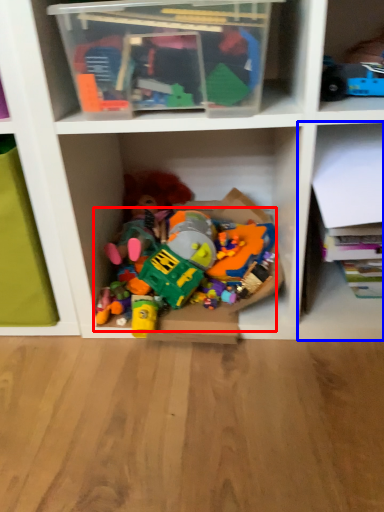
Question: Which point is further to the camera, toy (highlighted by a red box) or shelf (highlighted by a blue box)?

Choices:
 (A) toy
 (B) shelf

Answer: (A)